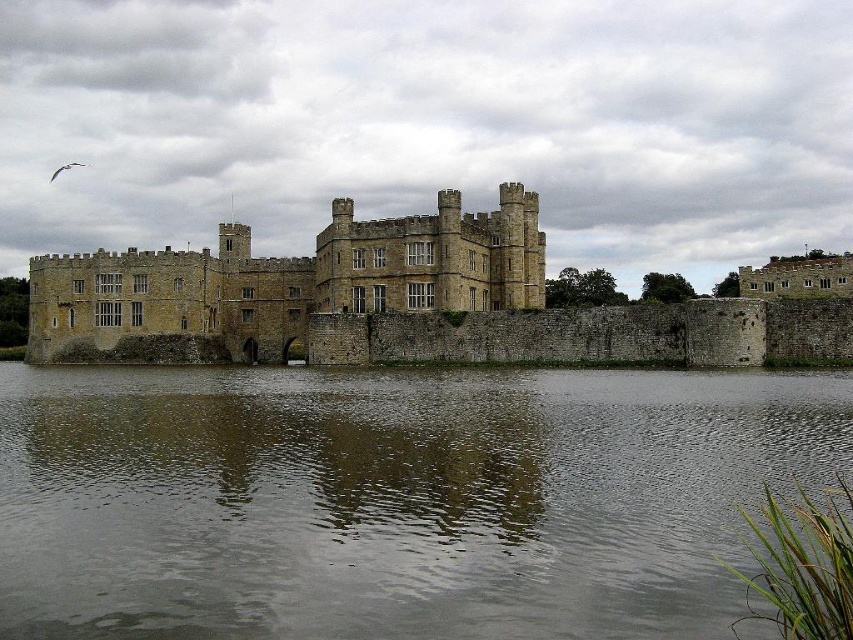
In the scene shown: You are a painter wanting to capture the castle and its reflection in your artwork. Since you have limited canvas space, you need to know which of the two elements, the gray reflective water at center or the brown stone castle at upper right, takes up more area in the image. Could you determine this?

The gray reflective water at center is bigger than the brown stone castle at upper right, so it occupies more area in the image.

Consider the image. You are a tour guide explaining the castle to visitors. You mention the gray reflective water at center and the stone castle at center. Which one do you think is wider from the visitors perspective?

The gray reflective water at center might be wider than the stone castle at center according to the description.

You are a visitor standing in front of the stone castle at center, looking at the gray reflective water at center. Which object is located directly below the other?

The gray reflective water at center is positioned under the stone castle at center, so the gray reflective water at center is directly below the stone castle at center.